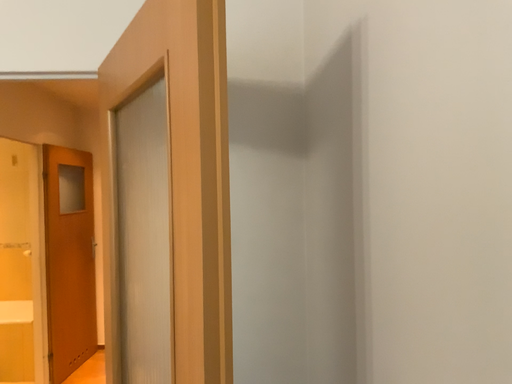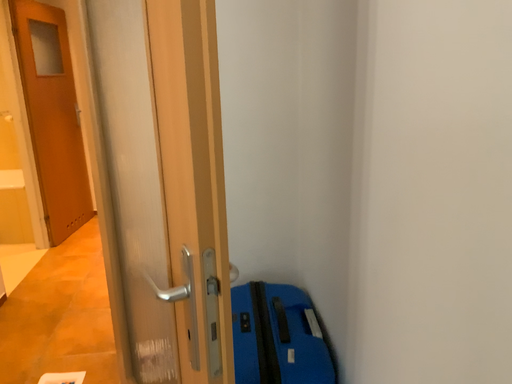
Question: How did the camera likely rotate when shooting the video?

Choices:
 (A) rotated upward
 (B) rotated downward

Answer: (B)